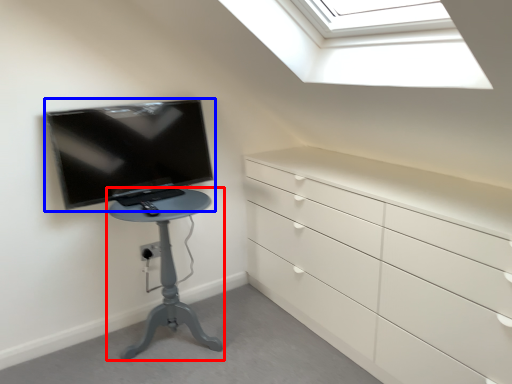
Question: Which of the following is the farthest to the observer, furniture (highlighted by a red box) or television (highlighted by a blue box)?

Choices:
 (A) furniture
 (B) television

Answer: (B)